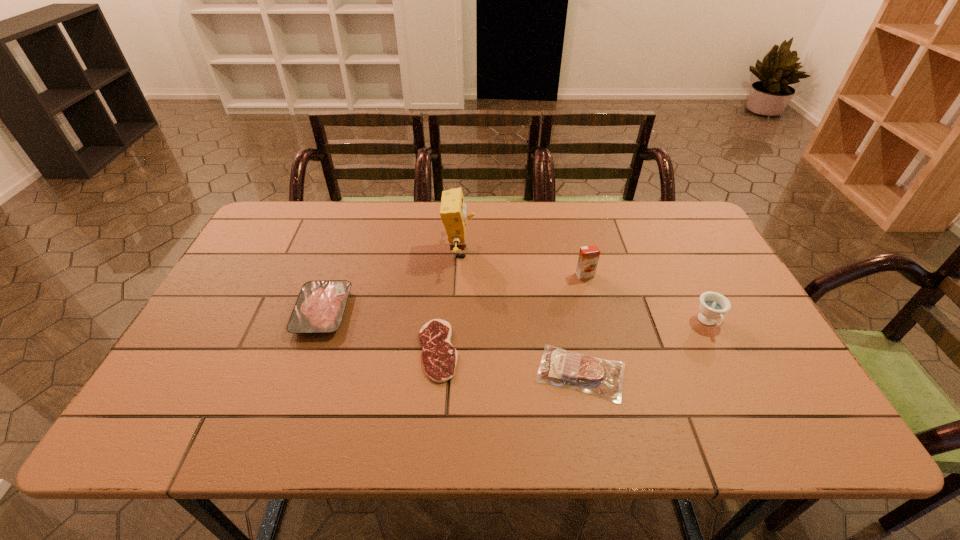
This screenshot has width=960, height=540. What are the coordinates of `free space between the sponge and the orange juice` in the screenshot? It's located at (522, 264).

Find the location of a particular element. empty space between the shortest object and the rightmost steak is located at coordinates (509, 361).

The height and width of the screenshot is (540, 960). In order to click on vacant area between the second tallest object and the teacup in this screenshot , I will do `click(647, 299)`.

Point out which object is positioned as the third nearest to the orange juice. Please provide its 2D coordinates. Your answer should be formatted as a tuple, i.e. [(x, y)], where the tuple contains the x and y coordinates of a point satisfying the conditions above.

[(453, 210)]

Choose which object is the third nearest neighbor to the third tallest object. Please provide its 2D coordinates. Your answer should be formatted as a tuple, i.e. [(x, y)], where the tuple contains the x and y coordinates of a point satisfying the conditions above.

[(453, 210)]

Locate which steak is the closest to the leftmost steak. Please provide its 2D coordinates. Your answer should be formatted as a tuple, i.e. [(x, y)], where the tuple contains the x and y coordinates of a point satisfying the conditions above.

[(439, 357)]

Find the location of `steak object that ranks as the second closest to the teacup`. steak object that ranks as the second closest to the teacup is located at coordinates (439, 357).

Locate an element on the screen. The width and height of the screenshot is (960, 540). free space that satisfies the following two spatial constraints: 1. on the back side of the orange juice; 2. on the right side of the leftmost object is located at coordinates (336, 275).

Identify the location of vacant area that satisfies the following two spatial constraints: 1. on the back side of the rightmost steak; 2. on the face of the sponge. (557, 252).